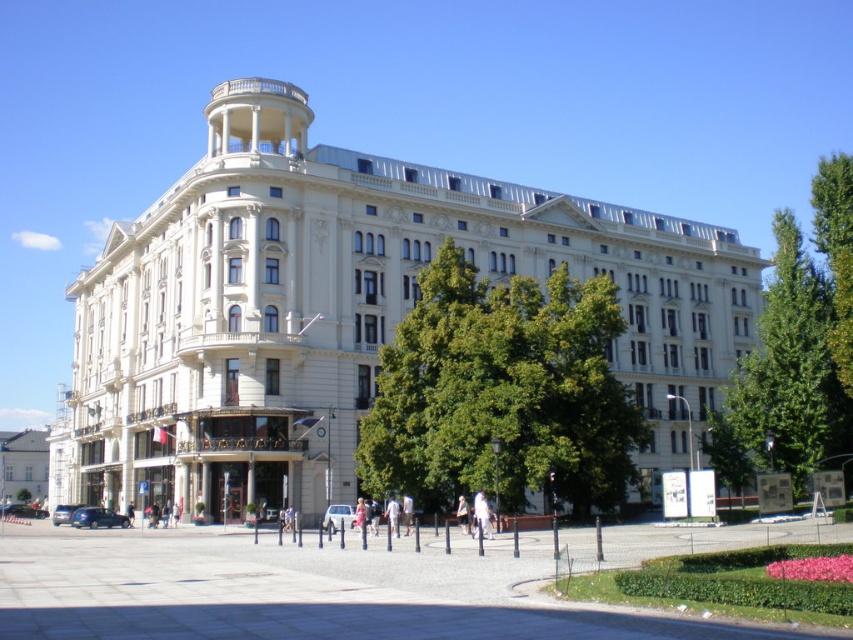
You are a visitor standing in the plaza in front of the white stone building at center. You want to take a photo of the building with the green leafy tree at right in the background. To ensure the tree is fully visible in the frame, should you move closer to or farther away from the building?

Since the white stone building at center might be wider than the green leafy tree at right, you should move closer to the building to ensure the tree fits into the background of your photo.

You are standing at the entrance of the grand building and want to find the green leafy tree at center. According to the coordinates provided, in which direction should you look to locate it?

The green leafy tree at center is located at coordinates point (502, 392), which means it is positioned to the right and slightly forward from the entrance. You should look towards the right side of the plaza to find it.